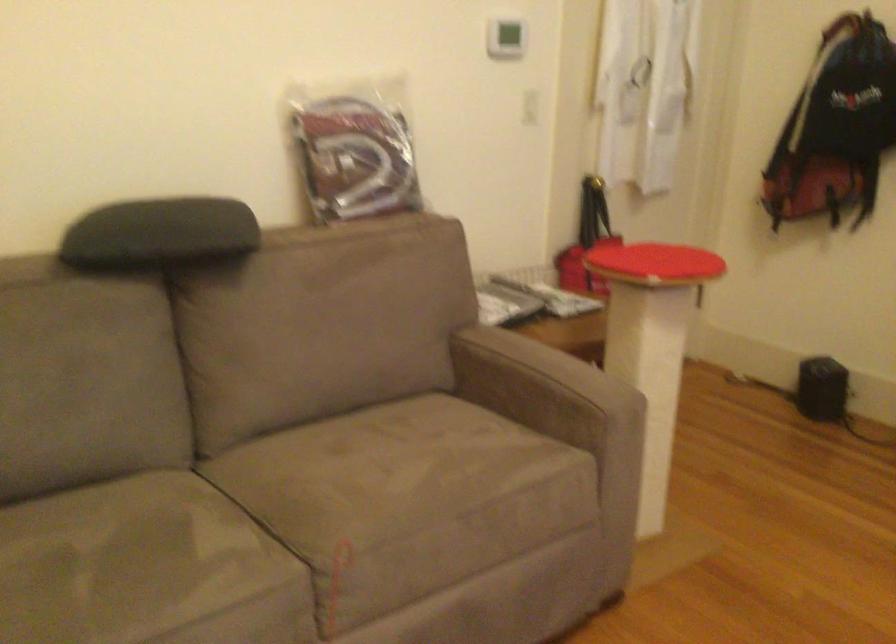
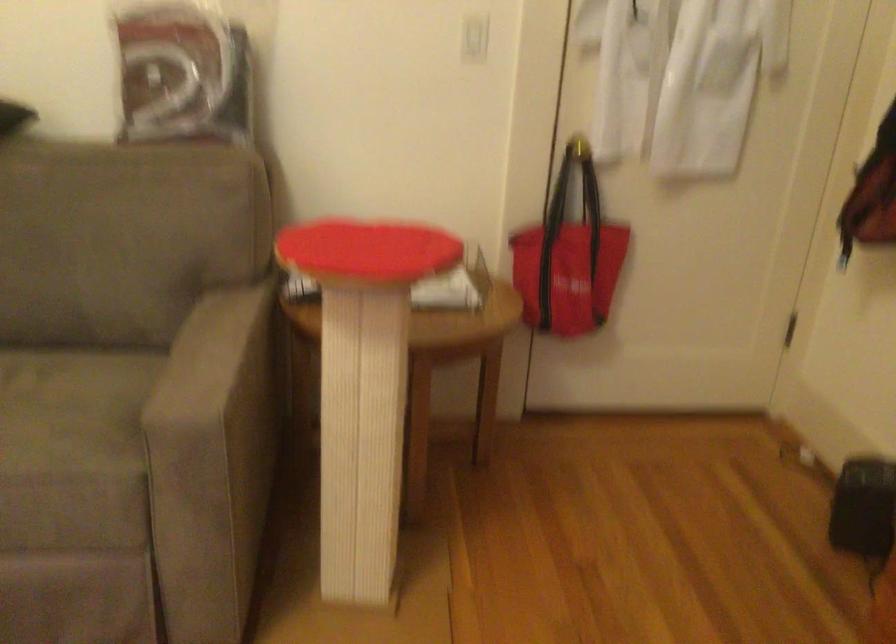
Find the pixel in the second image that matches (561,373) in the first image.

(212, 360)